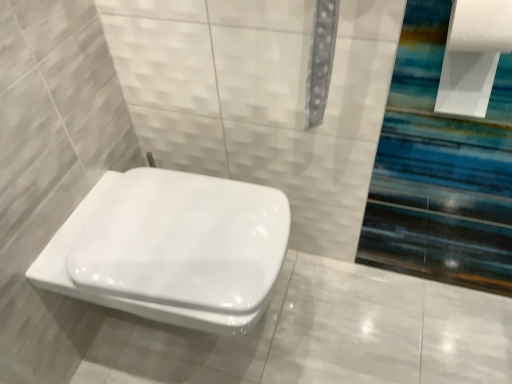
Question: Does white glossy toilet at center lie in front of white paper at upper right?

Choices:
 (A) yes
 (B) no

Answer: (B)

Question: From the image's perspective, is white glossy toilet at center on white paper at upper right?

Choices:
 (A) yes
 (B) no

Answer: (B)

Question: Is white glossy toilet at center bigger than white paper at upper right?

Choices:
 (A) no
 (B) yes

Answer: (B)

Question: From the image's perspective, would you say white glossy toilet at center is shown under white paper at upper right?

Choices:
 (A) yes
 (B) no

Answer: (A)

Question: Can you confirm if white glossy toilet at center is thinner than white paper at upper right?

Choices:
 (A) yes
 (B) no

Answer: (B)

Question: Is white glossy toilet at center facing away from white paper at upper right?

Choices:
 (A) no
 (B) yes

Answer: (A)

Question: Does white paper at upper right have a lesser height compared to white glossy toilet at center?

Choices:
 (A) no
 (B) yes

Answer: (B)

Question: Does white paper at upper right have a lesser width compared to white glossy toilet at center?

Choices:
 (A) yes
 (B) no

Answer: (A)

Question: From a real-world perspective, is white paper at upper right physically below white glossy toilet at center?

Choices:
 (A) yes
 (B) no

Answer: (B)

Question: Does white paper at upper right appear on the left side of white glossy toilet at center?

Choices:
 (A) no
 (B) yes

Answer: (A)

Question: Is white paper at upper right positioned before white glossy toilet at center?

Choices:
 (A) yes
 (B) no

Answer: (A)

Question: Is the depth of white paper at upper right greater than that of white glossy toilet at center?

Choices:
 (A) no
 (B) yes

Answer: (A)

Question: From their relative heights in the image, would you say white glossy toilet at center is taller or shorter than white paper at upper right?

Choices:
 (A) tall
 (B) short

Answer: (A)